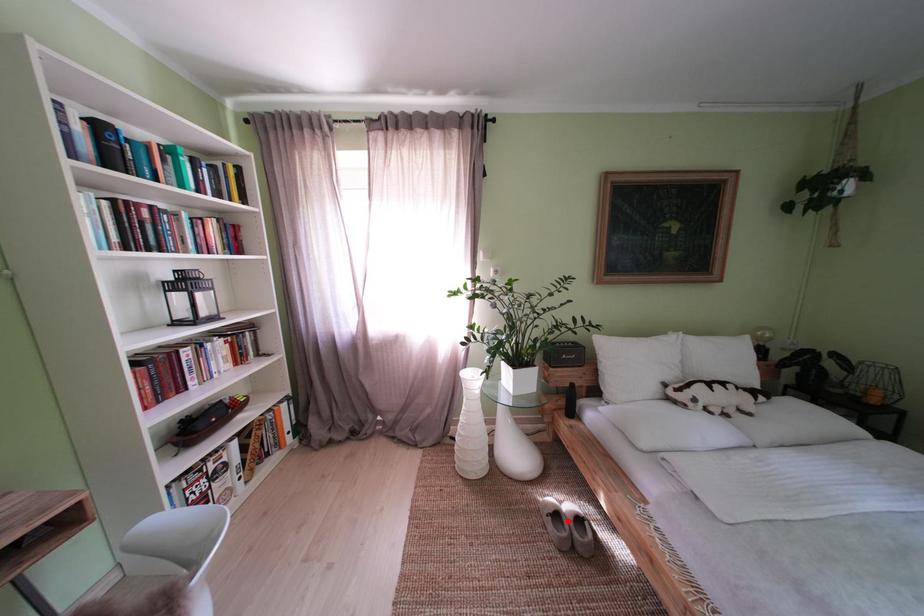
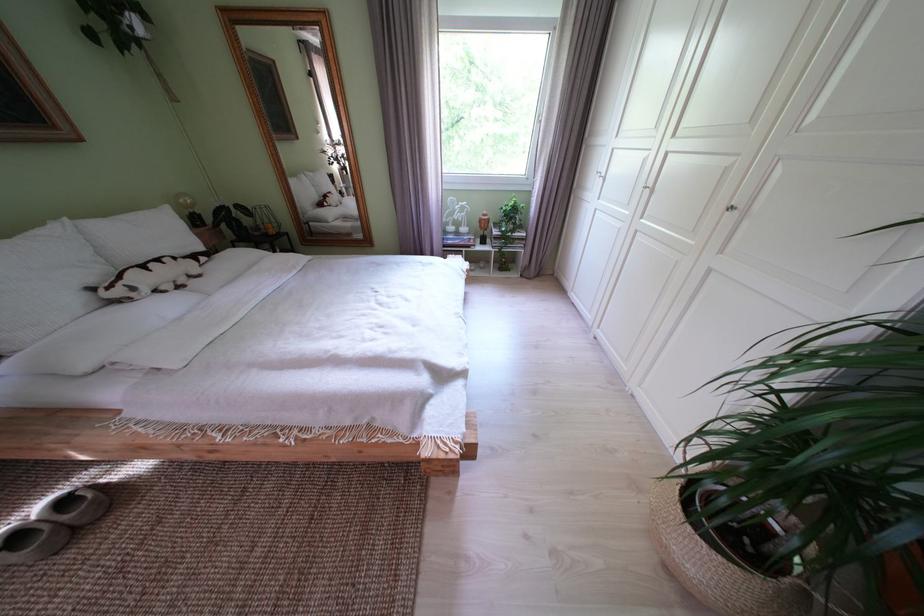
In the second image, find the point that corresponds to the highlighted location in the first image.

(28, 543)